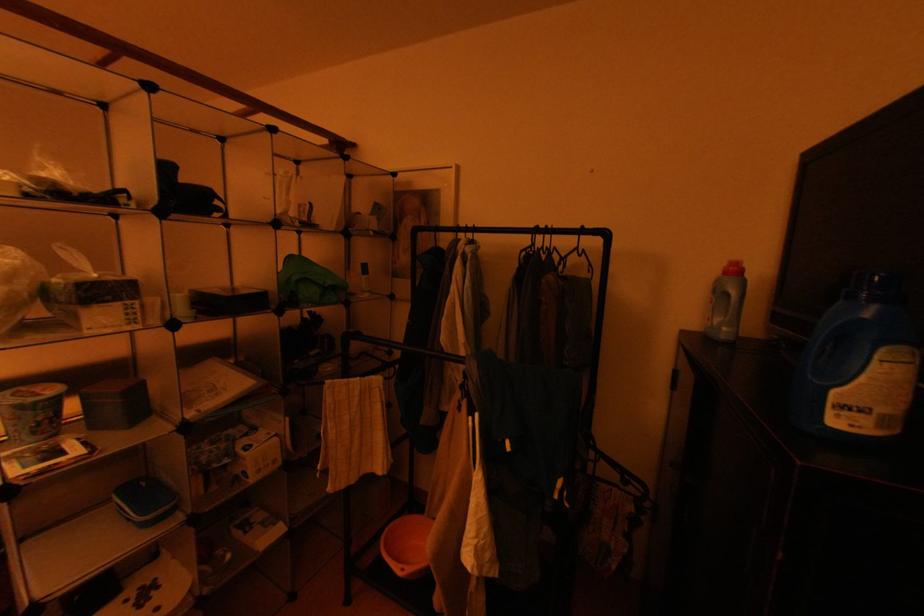
Find the location of `black square box`. black square box is located at coordinates (115, 403).